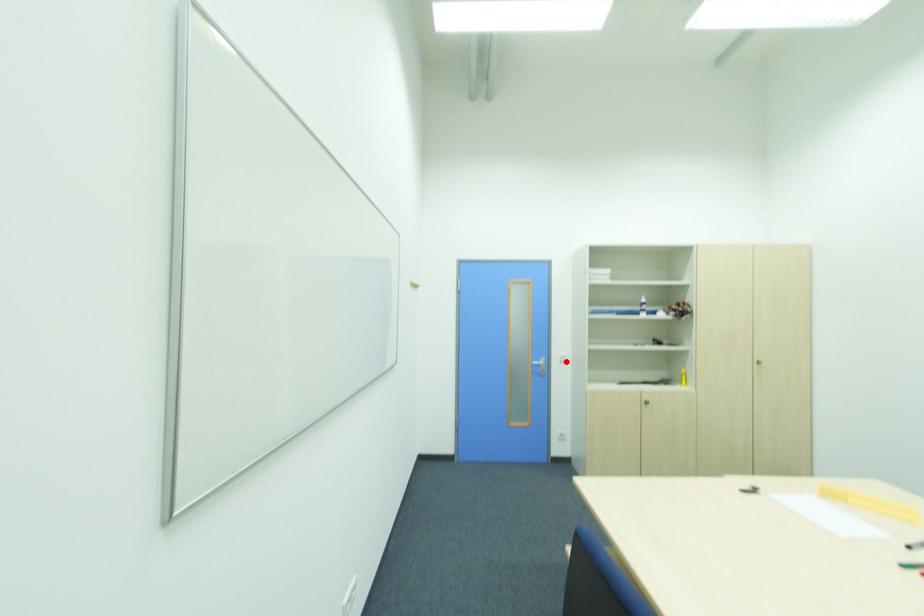
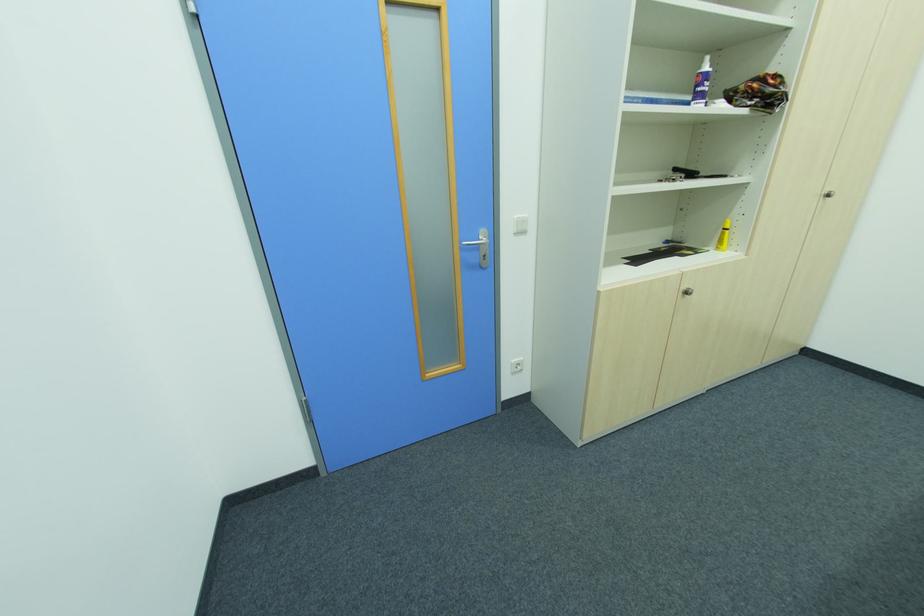
Find the pixel in the second image that matches the highlighted location in the first image.

(525, 233)